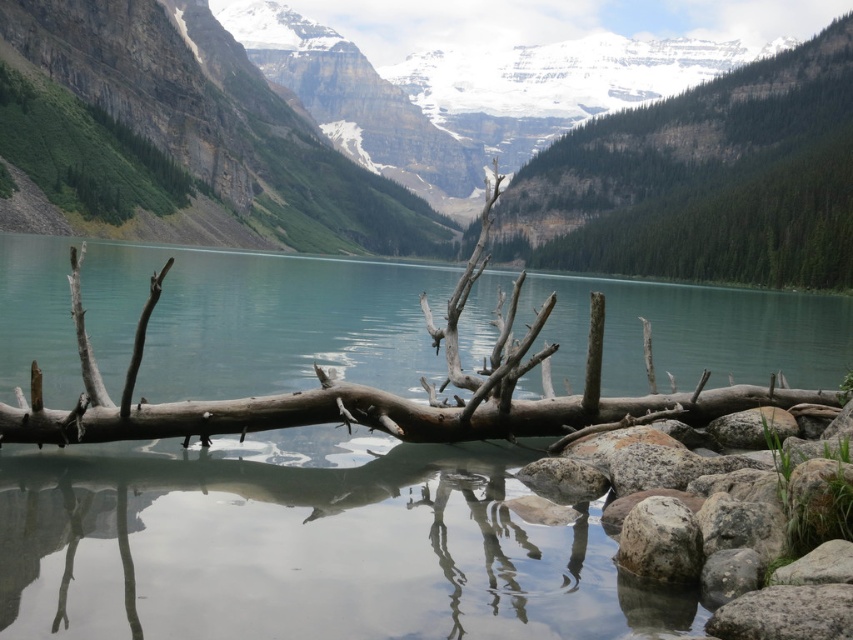
You are a hiker who wants to take a photo of the green textured tree at upper center and the gray rough rock at lower right. Which object should you focus on first if you want to capture both in a single frame without moving your camera?

You should focus on the green textured tree at upper center first because it is wider than the gray rough rock at lower right, so it will take up more space in the frame.